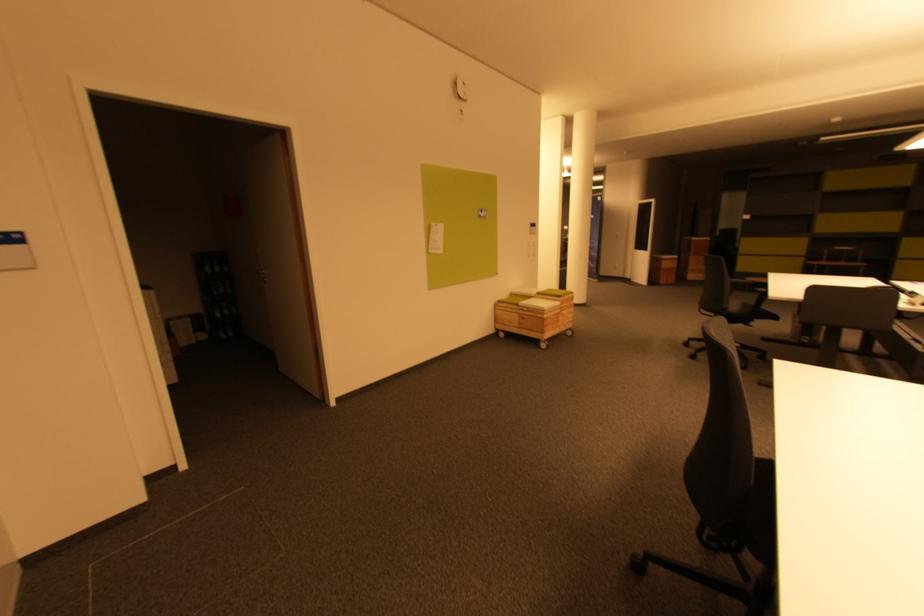
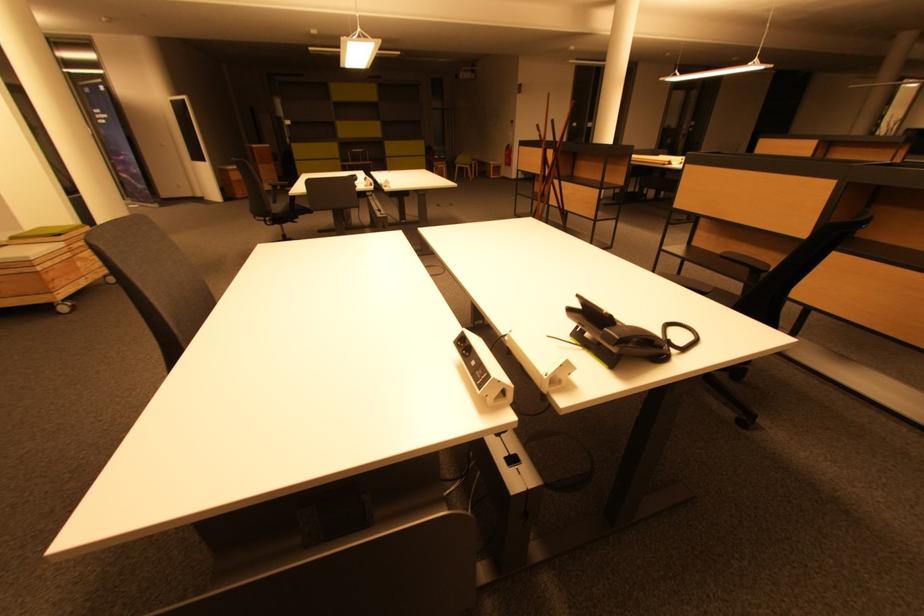
Where in the second image is the point corresponding to the point at 738,307 from the first image?

(281, 209)